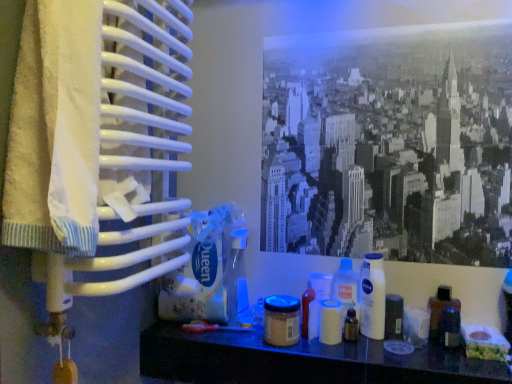
I want to click on free space in front of translucent plastic tube at center, which is the third toiletry from left to right, so click(322, 356).